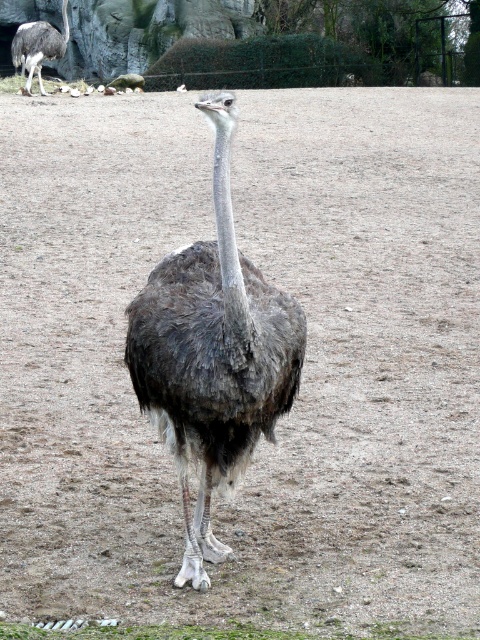
Question: Is dark gray feathers at center bigger than dark gray feathers at upper left?

Choices:
 (A) yes
 (B) no

Answer: (A)

Question: Which object is farther from the camera taking this photo?

Choices:
 (A) dark gray feathers at center
 (B) dark gray feathers at upper left

Answer: (B)

Question: Does dark gray feathers at center have a smaller size compared to dark gray feathers at upper left?

Choices:
 (A) yes
 (B) no

Answer: (B)

Question: Among these objects, which one is nearest to the camera?

Choices:
 (A) dark gray feathers at upper left
 (B) dark gray feathers at center

Answer: (B)

Question: Can you confirm if dark gray feathers at center is positioned to the right of dark gray feathers at upper left?

Choices:
 (A) yes
 (B) no

Answer: (A)

Question: Which point is farther to the camera?

Choices:
 (A) dark gray feathers at upper left
 (B) dark gray feathers at center

Answer: (A)